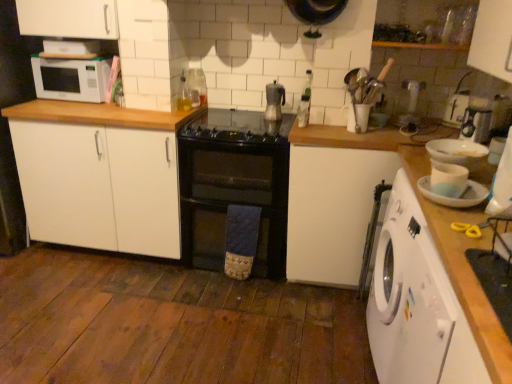
Question: Would you say metallic silver coffee maker at center, arranged as the 1th appliance when viewed from the top, is to the left or to the right of black glass gas stove at center in the picture?

Choices:
 (A) left
 (B) right

Answer: (B)

Question: From the image's perspective, relative to black glass gas stove at center, is metallic silver coffee maker at center, which is the 1th appliance in back-to-front order, above or below?

Choices:
 (A) below
 (B) above

Answer: (B)

Question: Estimate the real-world distances between objects in this image. Which object is closer to the clear glass bottle at upper center, acting as the second appliance starting from the left?

Choices:
 (A) white glossy mug at upper right, which appears as the third appliance when viewed from the back
 (B) white matte countertop at right
 (C) white matte cabinet at left
 (D) metallic silver coffee maker at center, positioned as the 1th appliance in left-to-right order
 (E) white plastic washing machine at right

Answer: (D)

Question: Which object is the closest to the white matte countertop at right?

Choices:
 (A) white matte cabinet at left
 (B) black glass oven at center
 (C) white matte microwave at upper left
 (D) clear glass bottle at upper center, which is the 2th appliance in right-to-left order
 (E) white plastic washing machine at right

Answer: (E)